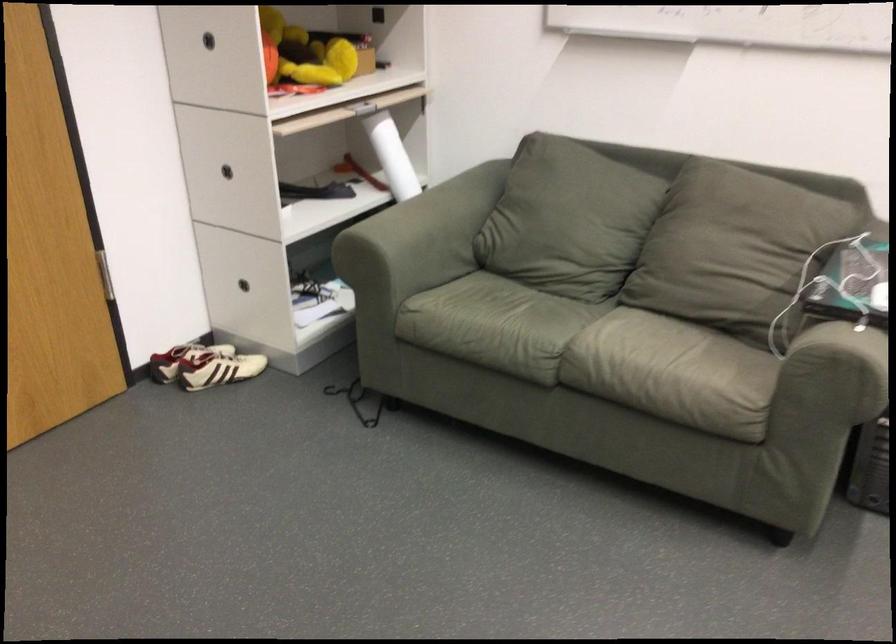
Image resolution: width=896 pixels, height=644 pixels. In order to click on yellow stuffed toy in this screenshot , I will do `click(303, 53)`.